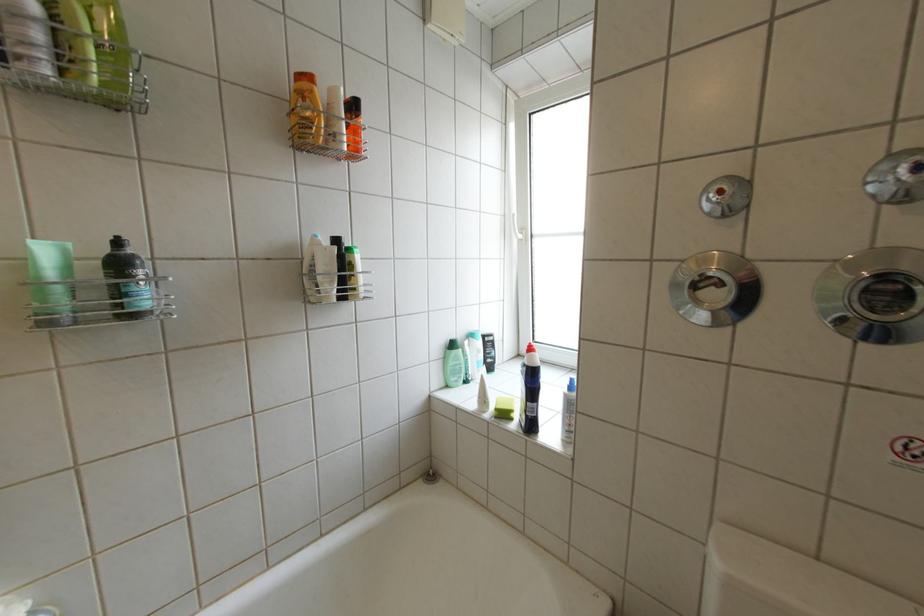
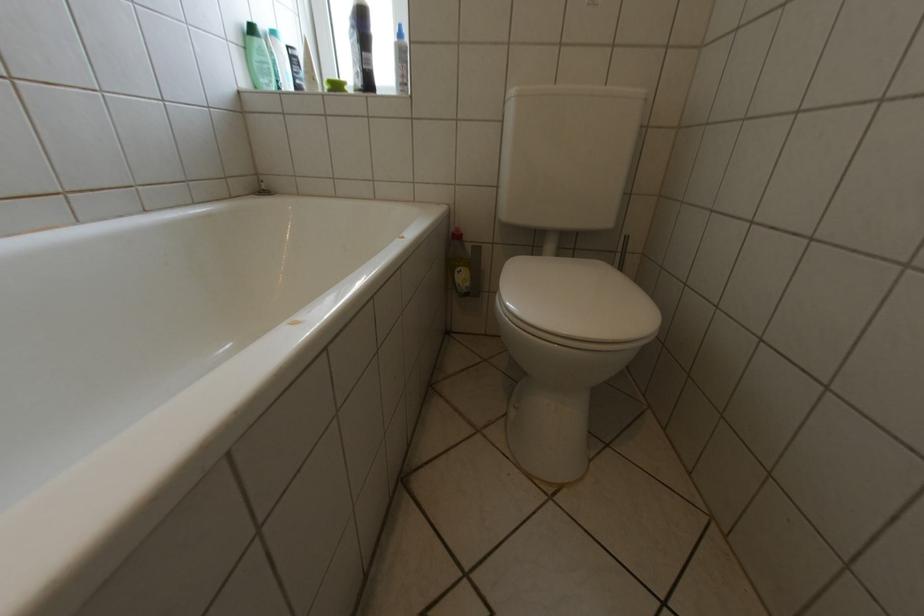
Locate, in the second image, the point that corresponds to (525,416) in the first image.

(359, 90)